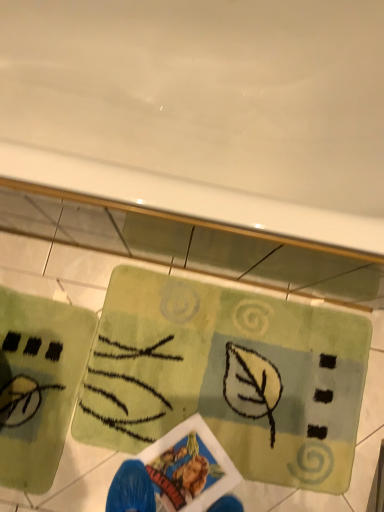
Find the location of `green textured rug at center, the second yoga mat in the left-to-right sequence`. green textured rug at center, the second yoga mat in the left-to-right sequence is located at coordinates (227, 377).

What is the approximate height of green textured rug at center, which ranks as the first yoga mat in right-to-left order?

green textured rug at center, which ranks as the first yoga mat in right-to-left order, is 1.45 inches tall.

Describe the element at coordinates (227, 377) in the screenshot. I see `green textured rug at center, the second yoga mat in the left-to-right sequence` at that location.

Where is `green soft yoga mat at lower left, arranged as the second yoga mat when viewed from the right`? Image resolution: width=384 pixels, height=512 pixels. green soft yoga mat at lower left, arranged as the second yoga mat when viewed from the right is located at coordinates (38, 384).

This screenshot has height=512, width=384. Describe the element at coordinates (38, 384) in the screenshot. I see `green soft yoga mat at lower left, the first yoga mat from the left` at that location.

This screenshot has height=512, width=384. I want to click on green textured rug at center, which ranks as the first yoga mat in right-to-left order, so click(227, 377).

Considering the relative positions of green soft yoga mat at lower left, the first yoga mat from the left, and green textured rug at center, which ranks as the first yoga mat in right-to-left order, in the image provided, is green soft yoga mat at lower left, the first yoga mat from the left, to the left of green textured rug at center, which ranks as the first yoga mat in right-to-left order, from the viewer's perspective?

Correct, you'll find green soft yoga mat at lower left, the first yoga mat from the left, to the left of green textured rug at center, which ranks as the first yoga mat in right-to-left order.

Considering their positions, is green soft yoga mat at lower left, the first yoga mat from the left, located in front of or behind green textured rug at center, the second yoga mat in the left-to-right sequence?

In the image, green soft yoga mat at lower left, the first yoga mat from the left, appears in front of green textured rug at center, the second yoga mat in the left-to-right sequence.

Is point (0, 464) farther from camera compared to point (301, 447)?

No, it is not.

From the image's perspective, would you say green soft yoga mat at lower left, the first yoga mat from the left, is shown under green textured rug at center, the second yoga mat in the left-to-right sequence?

Indeed, from the image's perspective, green soft yoga mat at lower left, the first yoga mat from the left, is shown beneath green textured rug at center, the second yoga mat in the left-to-right sequence.

From a real-world perspective, relative to green textured rug at center, which ranks as the first yoga mat in right-to-left order, is green soft yoga mat at lower left, arranged as the second yoga mat when viewed from the right, vertically above or below?

From a real-world perspective, green soft yoga mat at lower left, arranged as the second yoga mat when viewed from the right, is physically above green textured rug at center, which ranks as the first yoga mat in right-to-left order.

Which of these two, green soft yoga mat at lower left, the first yoga mat from the left, or green textured rug at center, the second yoga mat in the left-to-right sequence, is wider?

Wider between the two is green textured rug at center, the second yoga mat in the left-to-right sequence.

Between green soft yoga mat at lower left, the first yoga mat from the left, and green textured rug at center, which ranks as the first yoga mat in right-to-left order, which one has more height?

green soft yoga mat at lower left, the first yoga mat from the left, is taller.

Is green soft yoga mat at lower left, arranged as the second yoga mat when viewed from the right, bigger than green textured rug at center, the second yoga mat in the left-to-right sequence?

No, green soft yoga mat at lower left, arranged as the second yoga mat when viewed from the right, is not bigger than green textured rug at center, the second yoga mat in the left-to-right sequence.

Would you say green soft yoga mat at lower left, the first yoga mat from the left, contains green textured rug at center, which ranks as the first yoga mat in right-to-left order?

No, green textured rug at center, which ranks as the first yoga mat in right-to-left order, is located outside of green soft yoga mat at lower left, the first yoga mat from the left.

Does green soft yoga mat at lower left, the first yoga mat from the left, touch green textured rug at center, the second yoga mat in the left-to-right sequence?

green soft yoga mat at lower left, the first yoga mat from the left, is not next to green textured rug at center, the second yoga mat in the left-to-right sequence, and they're not touching.

Is green soft yoga mat at lower left, the first yoga mat from the left, aimed at green textured rug at center, the second yoga mat in the left-to-right sequence?

Yes, green soft yoga mat at lower left, the first yoga mat from the left, is turned towards green textured rug at center, the second yoga mat in the left-to-right sequence.

How different are the orientations of green soft yoga mat at lower left, arranged as the second yoga mat when viewed from the right, and green textured rug at center, the second yoga mat in the left-to-right sequence, in degrees?

The facing directions of green soft yoga mat at lower left, arranged as the second yoga mat when viewed from the right, and green textured rug at center, the second yoga mat in the left-to-right sequence, are 87.2 degrees apart.

Measure the distance between green soft yoga mat at lower left, arranged as the second yoga mat when viewed from the right, and green textured rug at center, which ranks as the first yoga mat in right-to-left order.

A distance of 11.07 inches exists between green soft yoga mat at lower left, arranged as the second yoga mat when viewed from the right, and green textured rug at center, which ranks as the first yoga mat in right-to-left order.

Where is `yoga mat that appears on the right of green soft yoga mat at lower left, the first yoga mat from the left`? This screenshot has width=384, height=512. yoga mat that appears on the right of green soft yoga mat at lower left, the first yoga mat from the left is located at coordinates (227, 377).

Considering the relative positions of green textured rug at center, which ranks as the first yoga mat in right-to-left order, and green soft yoga mat at lower left, arranged as the second yoga mat when viewed from the right, in the image provided, is green textured rug at center, which ranks as the first yoga mat in right-to-left order, to the left of green soft yoga mat at lower left, arranged as the second yoga mat when viewed from the right, from the viewer's perspective?

In fact, green textured rug at center, which ranks as the first yoga mat in right-to-left order, is to the right of green soft yoga mat at lower left, arranged as the second yoga mat when viewed from the right.

Which object is closer to the camera, green textured rug at center, the second yoga mat in the left-to-right sequence, or green soft yoga mat at lower left, the first yoga mat from the left?

Positioned in front is green soft yoga mat at lower left, the first yoga mat from the left.

Between point (127, 298) and point (56, 471), which one is positioned behind?

The point (127, 298) is behind.

Consider the image. From the image's perspective, which one is positioned higher, green textured rug at center, which ranks as the first yoga mat in right-to-left order, or green soft yoga mat at lower left, the first yoga mat from the left?

green textured rug at center, which ranks as the first yoga mat in right-to-left order, is shown above in the image.

From a real-world perspective, who is located lower, green textured rug at center, which ranks as the first yoga mat in right-to-left order, or green soft yoga mat at lower left, arranged as the second yoga mat when viewed from the right?

green textured rug at center, which ranks as the first yoga mat in right-to-left order.

Considering the relative sizes of green textured rug at center, the second yoga mat in the left-to-right sequence, and green soft yoga mat at lower left, the first yoga mat from the left, in the image provided, is green textured rug at center, the second yoga mat in the left-to-right sequence, wider than green soft yoga mat at lower left, the first yoga mat from the left,?

Yes.

Looking at this image, can you confirm if green textured rug at center, the second yoga mat in the left-to-right sequence, is shorter than green soft yoga mat at lower left, the first yoga mat from the left?

Yes.

Is green textured rug at center, which ranks as the first yoga mat in right-to-left order, bigger than green soft yoga mat at lower left, the first yoga mat from the left?

Correct, green textured rug at center, which ranks as the first yoga mat in right-to-left order, is larger in size than green soft yoga mat at lower left, the first yoga mat from the left.

Is green soft yoga mat at lower left, the first yoga mat from the left, inside green textured rug at center, which ranks as the first yoga mat in right-to-left order?

→ Definitely not — green soft yoga mat at lower left, the first yoga mat from the left, is not inside green textured rug at center, which ranks as the first yoga mat in right-to-left order.

Are green textured rug at center, the second yoga mat in the left-to-right sequence, and green soft yoga mat at lower left, arranged as the second yoga mat when viewed from the right, making contact?

No, green textured rug at center, the second yoga mat in the left-to-right sequence, is not next to green soft yoga mat at lower left, arranged as the second yoga mat when viewed from the right.

Is green textured rug at center, the second yoga mat in the left-to-right sequence, facing towards green soft yoga mat at lower left, arranged as the second yoga mat when viewed from the right?

No.

How different are the orientations of green textured rug at center, which ranks as the first yoga mat in right-to-left order, and green soft yoga mat at lower left, arranged as the second yoga mat when viewed from the right, in degrees?

The angle between the facing direction of green textured rug at center, which ranks as the first yoga mat in right-to-left order, and the facing direction of green soft yoga mat at lower left, arranged as the second yoga mat when viewed from the right, is 87.2 degrees.

Where is `yoga mat below the green textured rug at center, which ranks as the first yoga mat in right-to-left order (from the image's perspective)`? This screenshot has height=512, width=384. yoga mat below the green textured rug at center, which ranks as the first yoga mat in right-to-left order (from the image's perspective) is located at coordinates (38, 384).

Find the location of a particular element. The width and height of the screenshot is (384, 512). yoga mat below the green soft yoga mat at lower left, arranged as the second yoga mat when viewed from the right (from a real-world perspective) is located at coordinates (227, 377).

Identify the location of yoga mat lying behind the green soft yoga mat at lower left, arranged as the second yoga mat when viewed from the right. (227, 377).